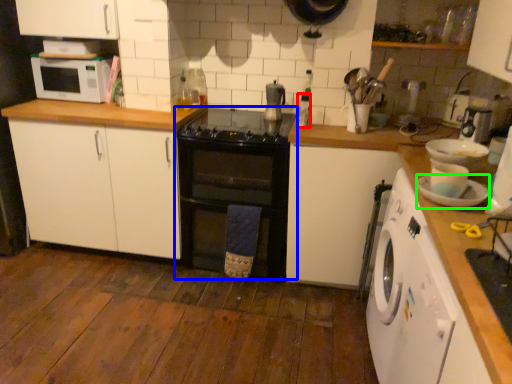
Question: Which object is the closest to the appliance (highlighted by a red box)? Choose among these: oven (highlighted by a blue box) or appliance (highlighted by a green box).

Choices:
 (A) oven
 (B) appliance

Answer: (A)